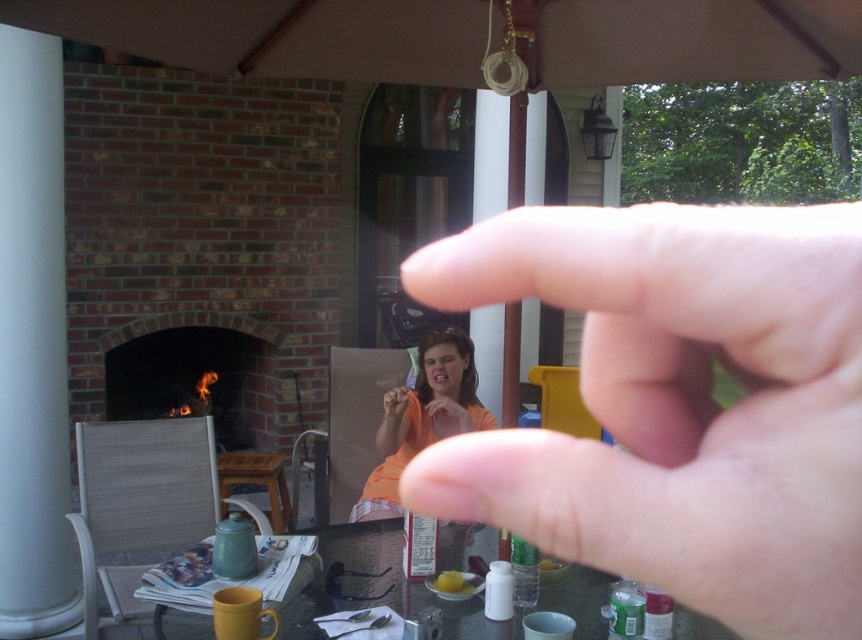
Who is positioned more to the left, flesh-toned skin at center or orange fabric shirt at center?

From the viewer's perspective, orange fabric shirt at center appears more on the left side.

Between point (472, 440) and point (438, 330), which one is positioned behind?

The point (438, 330) is behind.

Image resolution: width=862 pixels, height=640 pixels. What are the coordinates of `flesh-toned skin at center` in the screenshot? It's located at (678, 404).

Can you confirm if flesh-toned skin at center is positioned to the left of brick fireplace at center?

Incorrect, flesh-toned skin at center is not on the left side of brick fireplace at center.

From the picture: Does flesh-toned skin at center appear on the right side of brick fireplace at center?

Yes, flesh-toned skin at center is to the right of brick fireplace at center.

Find the location of a particular element. This screenshot has height=640, width=862. flesh-toned skin at center is located at coordinates (678, 404).

Looking at this image, how much distance is there between brick fireplace at center and orange fabric shirt at center?

brick fireplace at center and orange fabric shirt at center are 2.15 meters apart.

Between brick fireplace at center and orange fabric shirt at center, which one is positioned higher?

brick fireplace at center is above.

Between point (141, 388) and point (379, 476), which one is positioned in front?

Point (379, 476) is in front.

Find the location of a particular element. This screenshot has height=640, width=862. brick fireplace at center is located at coordinates (192, 371).